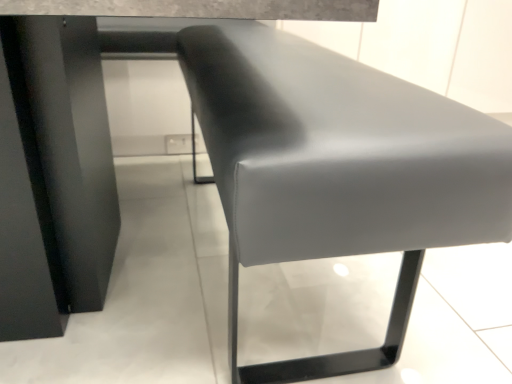
Describe the element at coordinates (338, 170) in the screenshot. This screenshot has width=512, height=384. I see `matte black chair at center` at that location.

Measure the distance between matte black chair at center and camera.

A distance of 18.37 inches exists between matte black chair at center and camera.

Where is `matte black chair at center`? matte black chair at center is located at coordinates (338, 170).

The width and height of the screenshot is (512, 384). Find the location of `matte black chair at center`. matte black chair at center is located at coordinates (338, 170).